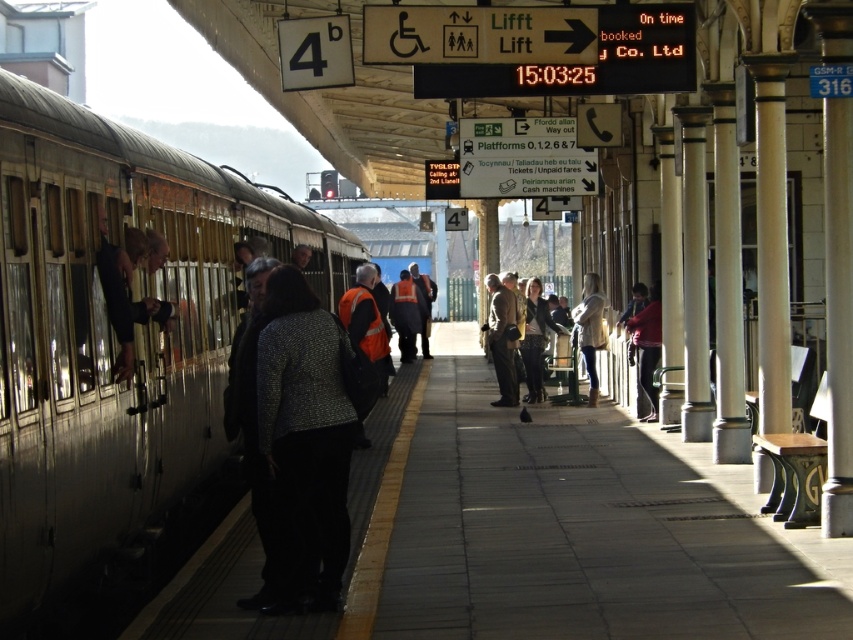
You are a passenger at the train station platform. You see the silver metallic train at left and the brown leather jacket at center. Which object takes up more space in the image?

The silver metallic train at left is bigger than the brown leather jacket at center, so it takes up more space in the image.

You are at the train station platform and want to board the silver metallic train at left. Where should you stand relative to the yellow tactile paving strip to board the train?

The silver metallic train at left is positioned at point (115, 332). To board the train, you should stand near the yellow tactile paving strip on the edge closest to the train, as that is where the train doors are located for passenger access.